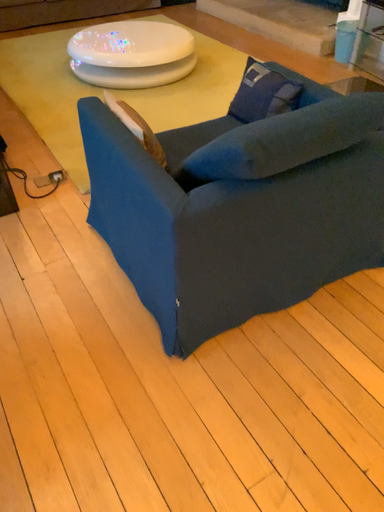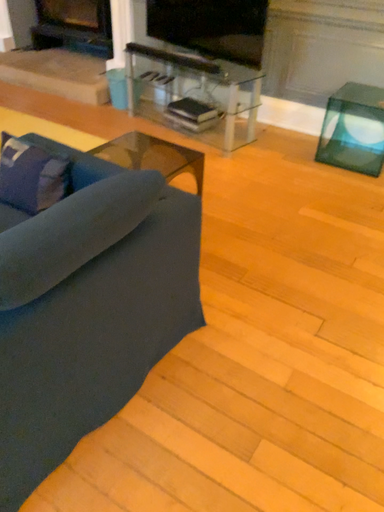
Question: Which way did the camera rotate in the video?

Choices:
 (A) rotated left
 (B) rotated right

Answer: (B)